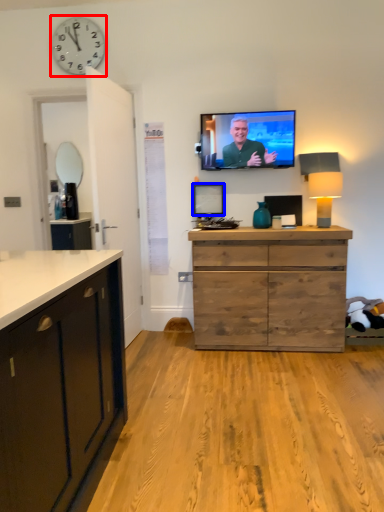
Question: Which object appears farthest to the camera in this image, clock (highlighted by a red box) or picture frame (highlighted by a blue box)?

Choices:
 (A) clock
 (B) picture frame

Answer: (B)